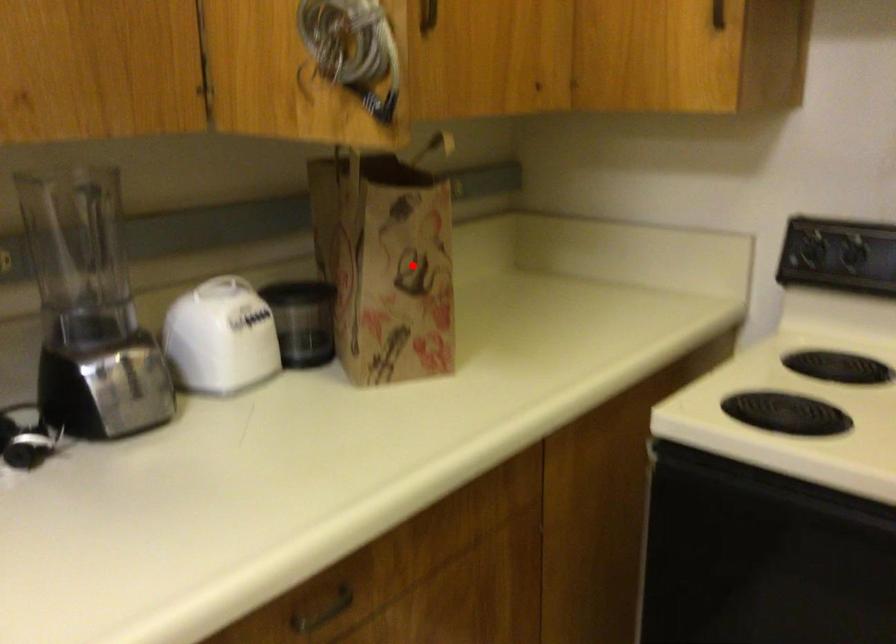
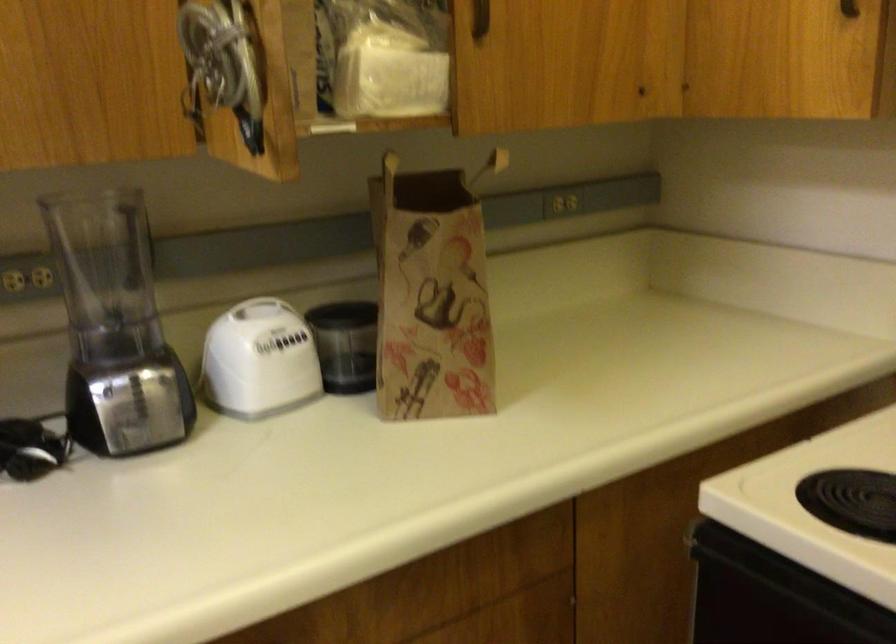
Question: I am providing you with two images of the same scene from different viewpoints. Image1 has a red point marked. In image2, the corresponding 3D location appears at what relative position? Reply with the corresponding letter.

Choices:
 (A) Closer
 (B) Farther

Answer: (A)